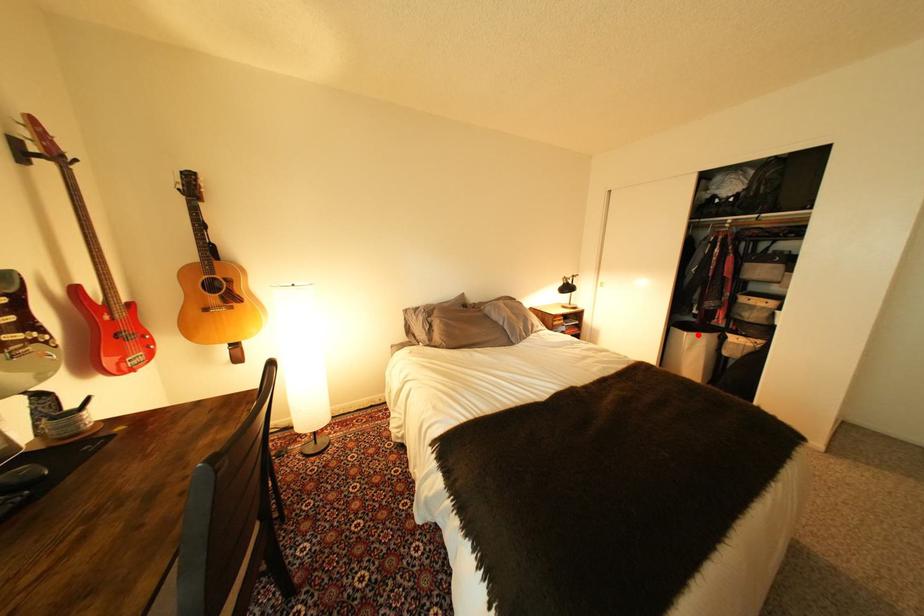
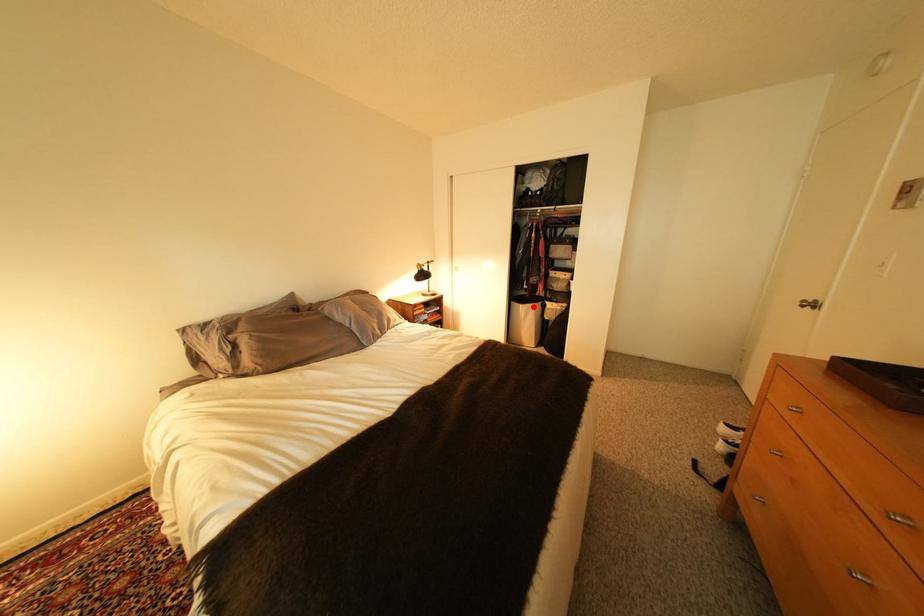
I am providing you with two images of the same scene from different viewpoints. A red point is marked on the first image and another point is marked on the second image. Is the marked point in image1 the same physical position as the marked point in image2?

Yes